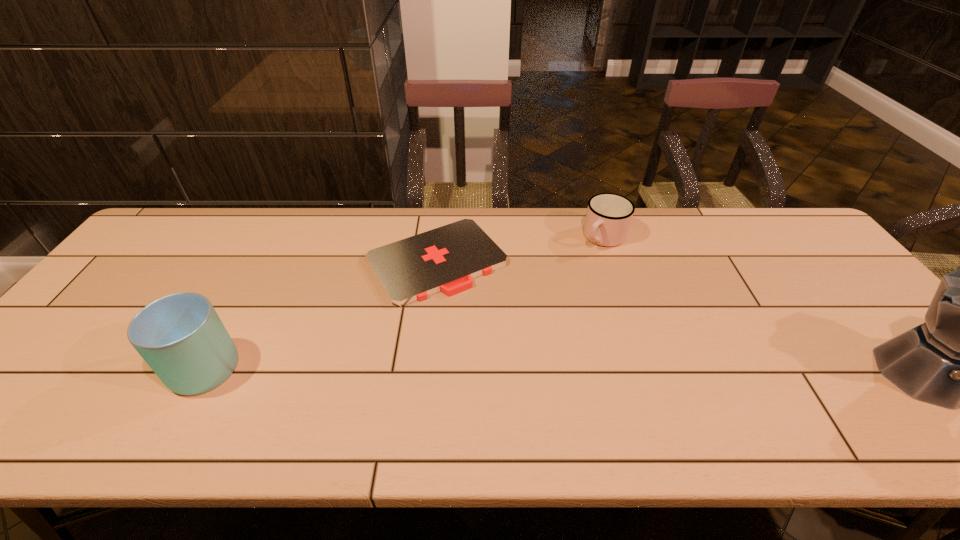
In the image, there is a desktop. Where is `vacant space at the far right corner`? The width and height of the screenshot is (960, 540). vacant space at the far right corner is located at coordinates (817, 249).

Identify the location of vacant area between the third object from right to left and the right mug. (520, 249).

Image resolution: width=960 pixels, height=540 pixels. I want to click on vacant area between the third object from right to left and the left mug, so click(319, 314).

Where is `free space between the shortest object and the nearer mug`? free space between the shortest object and the nearer mug is located at coordinates (319, 314).

This screenshot has width=960, height=540. I want to click on unoccupied area between the shortest object and the farther mug, so (x=520, y=249).

This screenshot has width=960, height=540. Find the location of `free point between the shortest object and the third object from left to right`. free point between the shortest object and the third object from left to right is located at coordinates (520, 249).

You are a GUI agent. You are given a task and a screenshot of the screen. Output one action in this format:
    pyautogui.click(x=<x>, y=<y>)
    Task: Click on the object identified as the third closest to the shortest object
    This screenshot has width=960, height=540.
    Given the screenshot: What is the action you would take?
    pyautogui.click(x=959, y=358)

This screenshot has width=960, height=540. I want to click on object that is the third closest one to the coffeepot, so click(x=180, y=336).

At what (x,y) coordinates should I click in order to perform the action: click on free space that satisfies the following two spatial constraints: 1. on the back side of the second object from left to right; 2. on the right side of the leftmost object. Please return your answer as a coordinate pair (x, y). The image size is (960, 540). Looking at the image, I should click on (259, 261).

Locate an element on the screen. This screenshot has height=540, width=960. vacant point that satisfies the following two spatial constraints: 1. on the back side of the right mug; 2. on the right side of the first-aid kit is located at coordinates (440, 237).